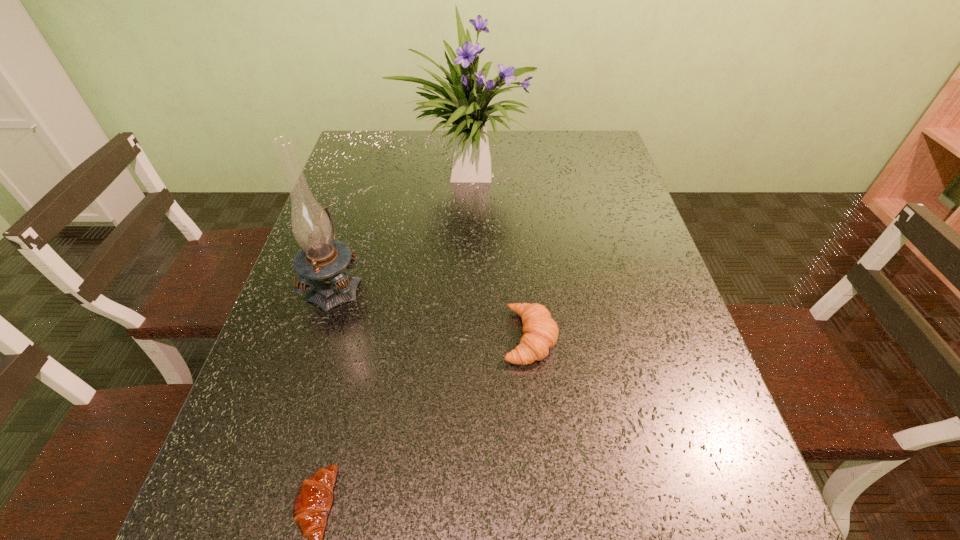
You are a GUI agent. You are given a task and a screenshot of the screen. Output one action in this format:
    pyautogui.click(x=<x>, y=<y>)
    Task: Click on the flower arrangement
    
    Given the screenshot: What is the action you would take?
    pyautogui.click(x=464, y=105)

Image resolution: width=960 pixels, height=540 pixels. I want to click on oil lamp, so click(320, 263).

This screenshot has height=540, width=960. I want to click on the farther crescent roll, so click(x=540, y=332).

Where is `the right crescent roll`? The height and width of the screenshot is (540, 960). the right crescent roll is located at coordinates (540, 332).

Find the location of a particular element. The width and height of the screenshot is (960, 540). free space located on the right of the farthest object is located at coordinates (551, 170).

Locate an element on the screen. This screenshot has height=540, width=960. vacant position located 0.330m on the back of the oil lamp is located at coordinates (368, 181).

The image size is (960, 540). Find the location of `free region located 0.340m on the back of the farther crescent roll`. free region located 0.340m on the back of the farther crescent roll is located at coordinates click(517, 213).

The width and height of the screenshot is (960, 540). In order to click on object that is at the far edge in this screenshot , I will do `click(464, 105)`.

The height and width of the screenshot is (540, 960). Find the location of `object at the left edge`. object at the left edge is located at coordinates (320, 263).

At what (x,y) coordinates should I click in order to perform the action: click on vacant space at the far edge. Please return your answer as a coordinate pair (x, y). This screenshot has width=960, height=540. Looking at the image, I should click on point(445,137).